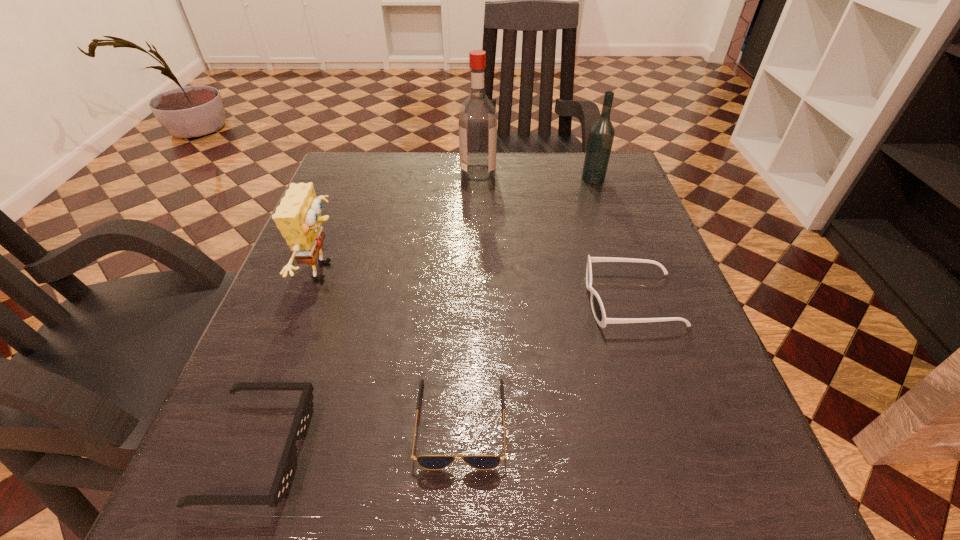
Where is `empty space that is in between the second sunglasses from right to left and the leftmost sunglasses`? The width and height of the screenshot is (960, 540). empty space that is in between the second sunglasses from right to left and the leftmost sunglasses is located at coordinates (359, 436).

Locate an element on the screen. This screenshot has height=540, width=960. vacant space that is in between the liquor and the leftmost sunglasses is located at coordinates (368, 312).

You are a GUI agent. You are given a task and a screenshot of the screen. Output one action in this format:
    pyautogui.click(x=<x>, y=<y>)
    Task: Click on the free space between the rightmost sunglasses and the third tallest object
    
    Given the screenshot: What is the action you would take?
    pyautogui.click(x=479, y=286)

The height and width of the screenshot is (540, 960). I want to click on free point between the liquor and the tallest sunglasses, so click(x=555, y=237).

At what (x,y) coordinates should I click in order to perform the action: click on empty space that is in between the tallest sunglasses and the second sunglasses from right to left. Please return your answer as a coordinate pair (x, y). Looking at the image, I should click on (546, 361).

The image size is (960, 540). I want to click on vacant point located between the leftmost sunglasses and the vodka, so click(425, 314).

Identify the location of free space between the tallest sunglasses and the second sunglasses from left to right. (546, 361).

Locate an element on the screen. The image size is (960, 540). object that can be found as the fourth closest to the second sunglasses from left to right is located at coordinates (477, 119).

Identify which object is located as the nearest to the farthest sunglasses. Please provide its 2D coordinates. Your answer should be formatted as a tuple, i.e. [(x, y)], where the tuple contains the x and y coordinates of a point satisfying the conditions above.

[(430, 462)]

Image resolution: width=960 pixels, height=540 pixels. In order to click on sunglasses that is the nearest to the tallest sunglasses in this screenshot , I will do `click(430, 462)`.